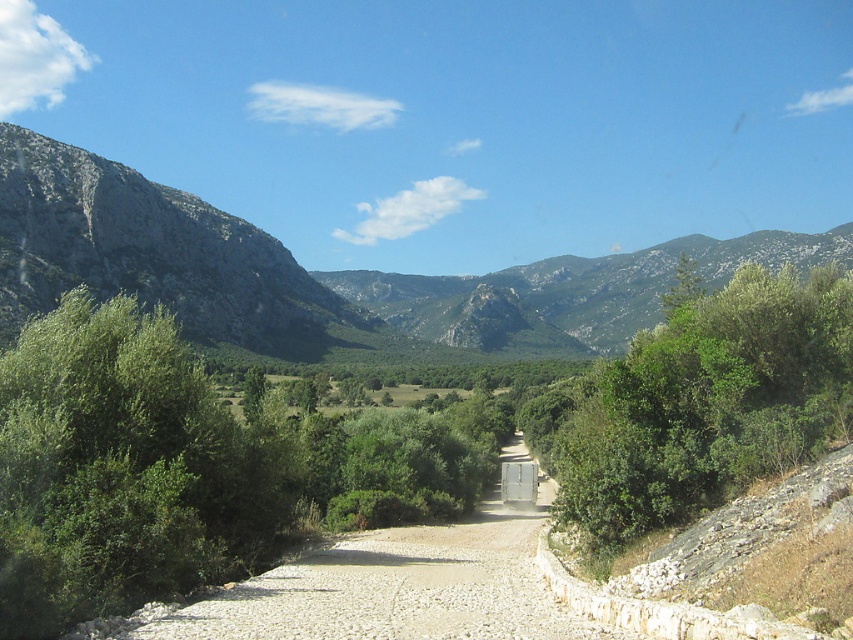
Does green rocky mountain at left have a greater width compared to green leafy bush at right?

Indeed, green rocky mountain at left has a greater width compared to green leafy bush at right.

The image size is (853, 640). In order to click on green rocky mountain at left in this screenshot , I will do (x=323, y=273).

Where is `green rocky mountain at left`? The image size is (853, 640). green rocky mountain at left is located at coordinates (323, 273).

I want to click on green leafy bush at right, so click(x=700, y=403).

This screenshot has width=853, height=640. What are the coordinates of `green leafy bush at right` in the screenshot? It's located at (700, 403).

Does green rocky mountain at left have a larger size compared to gray rocky mountain at left?

Indeed, green rocky mountain at left has a larger size compared to gray rocky mountain at left.

Measure the distance between point (776, 250) and camera.

Point (776, 250) is 368.90 meters away from camera.

This screenshot has width=853, height=640. Identify the location of green rocky mountain at left. (323, 273).